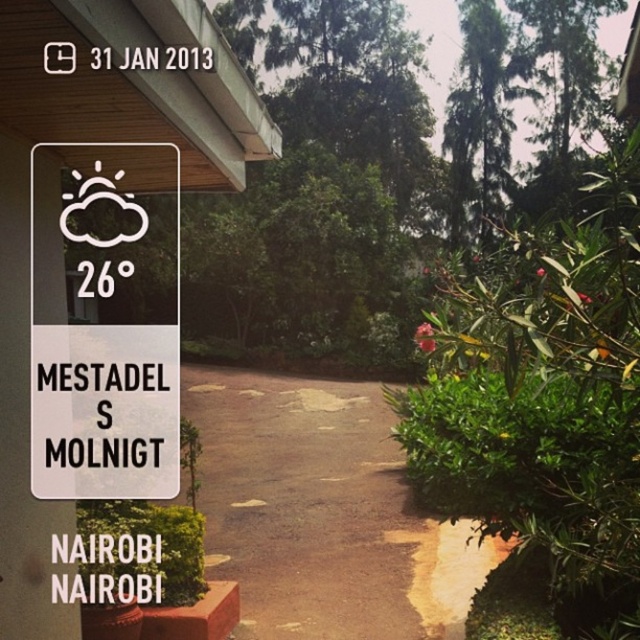
This screenshot has height=640, width=640. What are the coordinates of `brown asphalt path at center` in the screenshot? It's located at (323, 513).

Is brown asphalt path at center shorter than white plastic sign at upper left?

Incorrect, brown asphalt path at center's height does not fall short of white plastic sign at upper left's.

The height and width of the screenshot is (640, 640). Describe the element at coordinates (323, 513) in the screenshot. I see `brown asphalt path at center` at that location.

You are a GUI agent. You are given a task and a screenshot of the screen. Output one action in this format:
    pyautogui.click(x=<x>, y=<y>)
    Task: Click on the brown asphalt path at center
    The height and width of the screenshot is (640, 640).
    Given the screenshot: What is the action you would take?
    pyautogui.click(x=323, y=513)